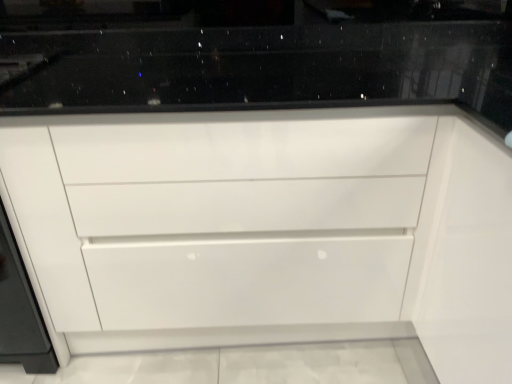
The width and height of the screenshot is (512, 384). Describe the element at coordinates (269, 230) in the screenshot. I see `glossy white drawer at center` at that location.

In order to face glossy white drawer at center, should I rotate leftwards or rightwards?

A 3.873 degree turn to the left will do.

Locate an element on the screen. glossy white drawer at center is located at coordinates (269, 230).

Locate an element on the screen. This screenshot has height=384, width=512. glossy white drawer at center is located at coordinates (269, 230).